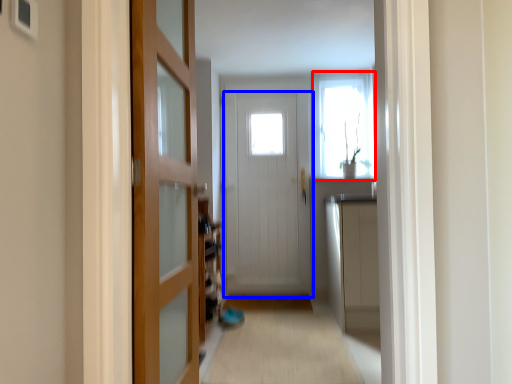
Question: Which object appears farthest to the camera in this image, window (highlighted by a red box) or door (highlighted by a blue box)?

Choices:
 (A) window
 (B) door

Answer: (A)